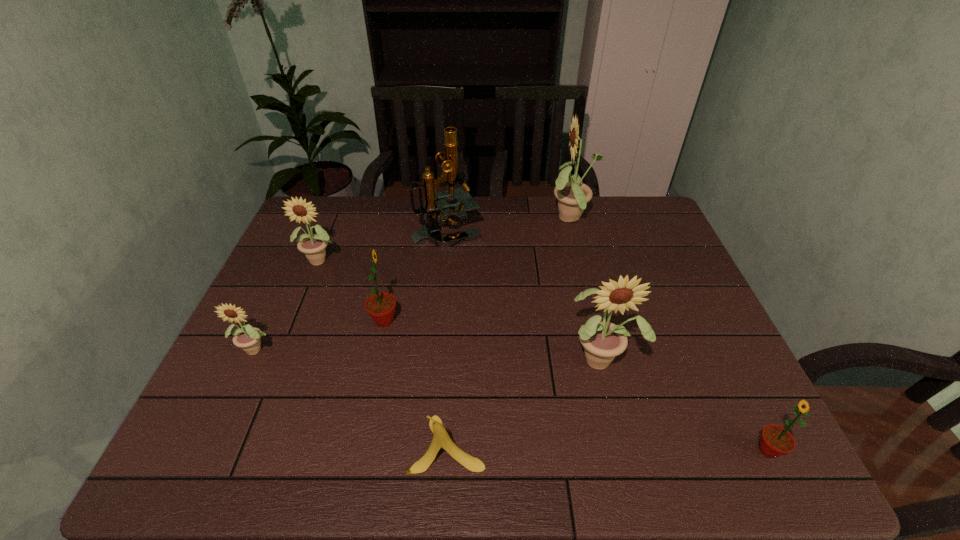
You are a GUI agent. You are given a task and a screenshot of the screen. Output one action in this format:
    pyautogui.click(x=<x>, y=<y>)
    Task: Click on the tallest sunflower
    The image size is (960, 540).
    Given the screenshot: What is the action you would take?
    pyautogui.click(x=573, y=196)

Identify the location of the biggest yellow sunflower. This screenshot has height=540, width=960. [573, 196].

Find the location of a particular element. Image resolution: width=960 pixels, height=540 pixels. microscope is located at coordinates (435, 201).

The image size is (960, 540). In order to click on the sixth shortest object in this screenshot , I will do `click(602, 340)`.

The width and height of the screenshot is (960, 540). Find the location of `the second tallest sunflower`. the second tallest sunflower is located at coordinates (602, 340).

At what (x,y) coordinates should I click in order to perform the action: click on the fourth sunflower from right to left. Please return your answer as a coordinate pair (x, y). This screenshot has height=540, width=960. Looking at the image, I should click on (381, 306).

The height and width of the screenshot is (540, 960). I want to click on the farther green sunflower, so click(381, 306).

The height and width of the screenshot is (540, 960). Identify the location of the fifth nearest sunflower. (312, 245).

Image resolution: width=960 pixels, height=540 pixels. What are the coordinates of `the third biggest yellow sunflower` in the screenshot? It's located at [312, 245].

Locate an element on the screen. the smallest yellow sunflower is located at coordinates (247, 337).